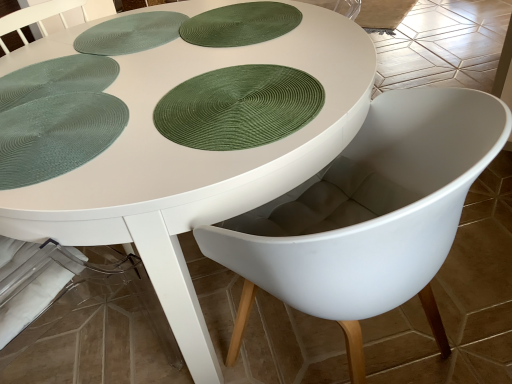
The image size is (512, 384). What are the coordinates of `vacant area that lies between green textured placemat at upper center, arranged as the 4th paper plate when ordered from the bottom, and green woven placemat at center, which is counted as the second paper plate, starting from the bottom` in the screenshot? It's located at (252, 57).